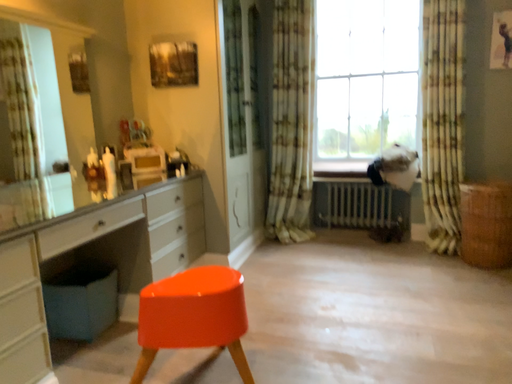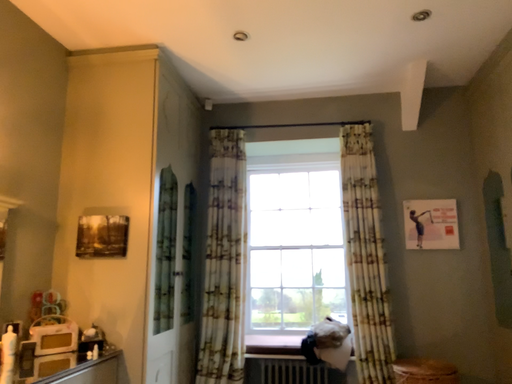
Question: How did the camera likely rotate when shooting the video?

Choices:
 (A) rotated right
 (B) rotated left

Answer: (A)